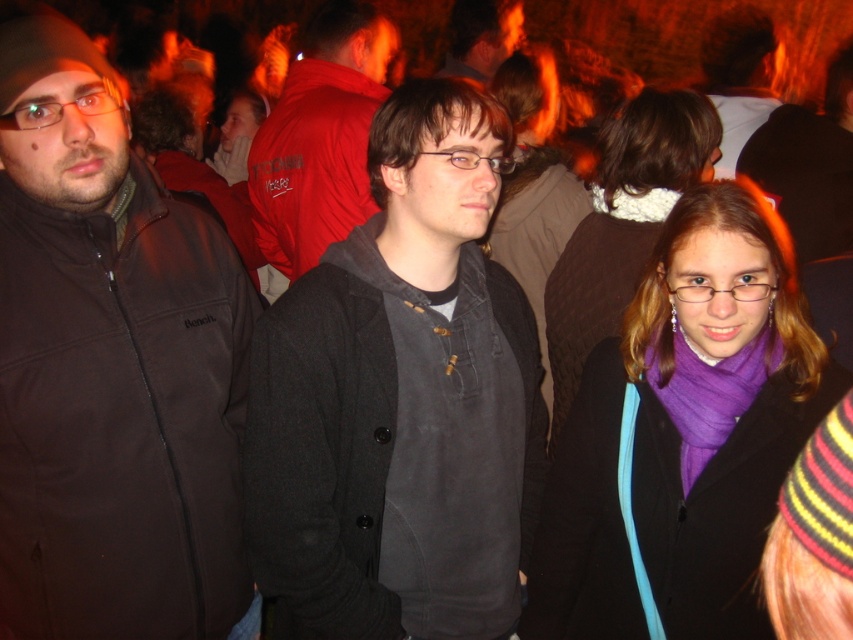
Question: Does purple wool scarf at center appear under red matte jacket at center?

Choices:
 (A) no
 (B) yes

Answer: (B)

Question: Based on their relative distances, which object is nearer to the dark gray hoodie at center?

Choices:
 (A) brown fleece jacket at left
 (B) matte black jacket at center
 (C) red matte jacket at center

Answer: (A)

Question: Which point is farther to the camera?

Choices:
 (A) (28, 490)
 (B) (660, 106)
 (C) (476, 76)

Answer: (C)

Question: Can you confirm if brown fleece jacket at left is bigger than dark gray hoodie at center?

Choices:
 (A) no
 (B) yes

Answer: (B)

Question: Considering the relative positions of purple wool scarf at center and red matte jacket at center in the image provided, where is purple wool scarf at center located with respect to red matte jacket at center?

Choices:
 (A) left
 (B) right

Answer: (B)

Question: Which object is farther from the camera taking this photo?

Choices:
 (A) purple wool scarf at center
 (B) purple knitted scarf at center
 (C) brown fleece jacket at left
 (D) red matte jacket at center

Answer: (D)